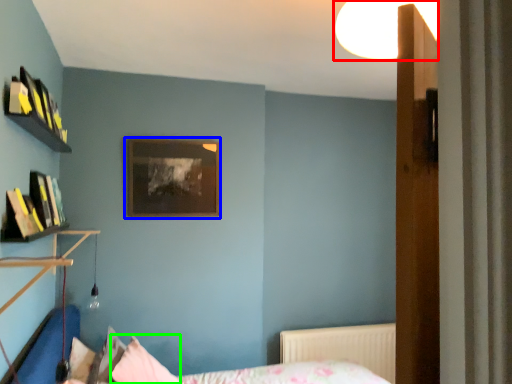
Question: Considering the real-world distances, which object is closest to light fixture (highlighted by a red box)? picture frame (highlighted by a blue box) or pillow (highlighted by a green box).

Choices:
 (A) picture frame
 (B) pillow

Answer: (A)